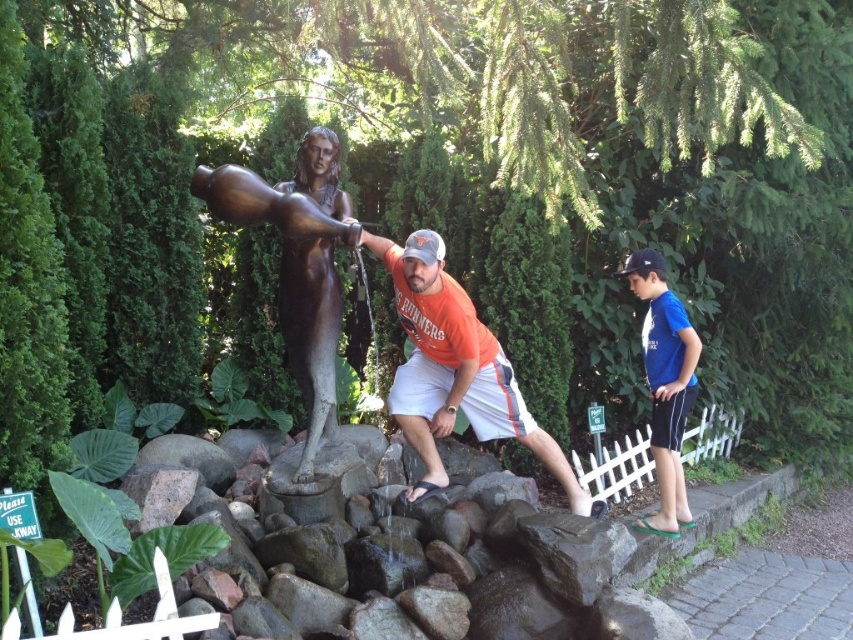
You are a photographer planning to take a wide shot of the bronze statue at center and the blue fabric shorts at right. Based on their sizes, which object should you position closer to the camera to ensure both fit in the frame?

The bronze statue at center is wider than the blue fabric shorts at right, so positioning the bronze statue at center closer to the camera would help ensure both fit in the frame as wider objects require more space when closer.

You are a photographer trying to capture a clear shot of the matte bronze statue at center and the blue fabric shorts at right. Based on their positions, which object should you focus on first to ensure both are in the frame?

The matte bronze statue at center is in front of the blue fabric shorts at right, so you should focus on the matte bronze statue at center first to ensure both are in the frame.